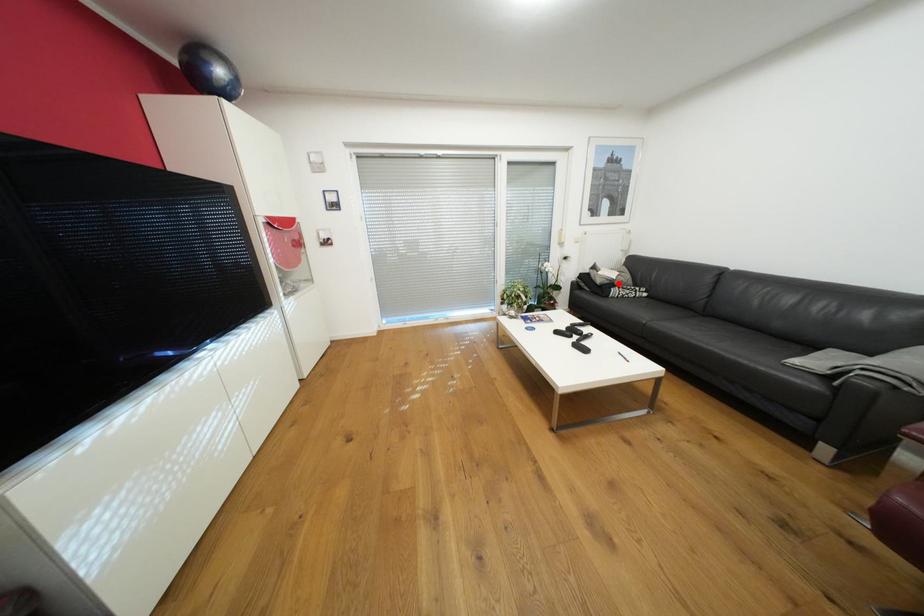
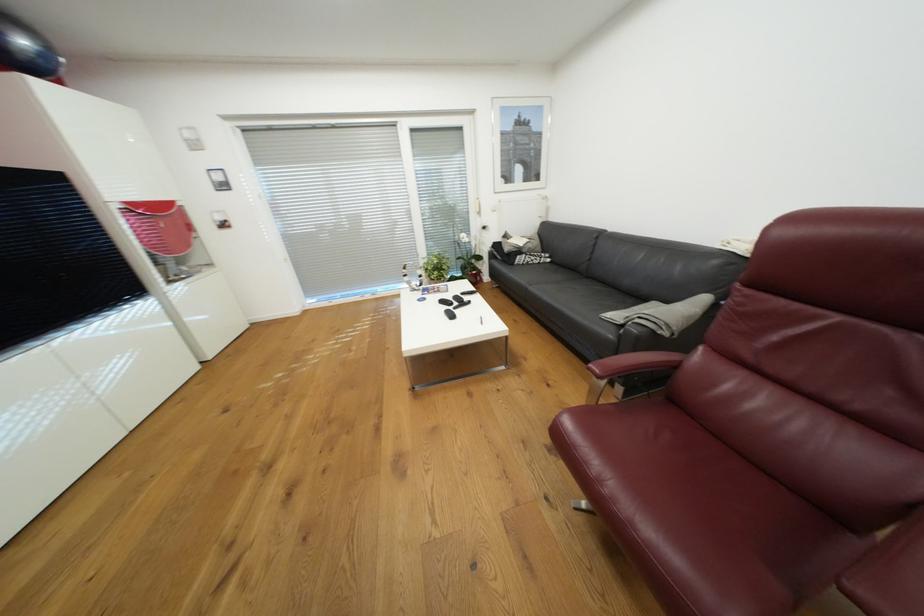
Find the pixel in the second image that matches the highlighted location in the first image.

(526, 252)